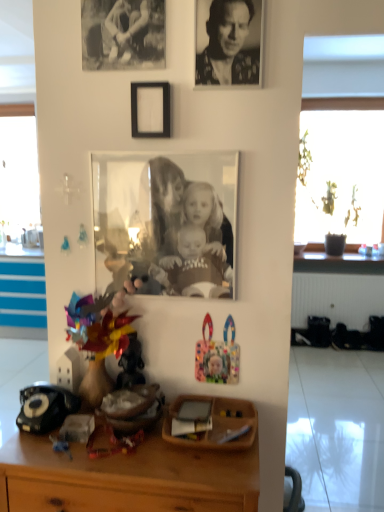
Question: Which direction should I rotate to look at multicolored plastic toy at lower center, which appears as the 3th toy when viewed from the left?

Choices:
 (A) left
 (B) right

Answer: (B)

Question: Is matte glass photo frame at center, positioned as the third picture frame in top-to-bottom order, thinner than wooden desk at center?

Choices:
 (A) yes
 (B) no

Answer: (A)

Question: Is matte glass photo frame at center, placed as the 1th picture frame when sorted from bottom to top, not close to wooden desk at center?

Choices:
 (A) no
 (B) yes

Answer: (A)

Question: Is matte glass photo frame at center, placed as the 1th picture frame when sorted from bottom to top, placed right next to wooden desk at center?

Choices:
 (A) no
 (B) yes

Answer: (A)

Question: Considering the relative positions of matte glass photo frame at center, placed as the 1th picture frame when sorted from bottom to top, and wooden desk at center in the image provided, is matte glass photo frame at center, placed as the 1th picture frame when sorted from bottom to top, to the right of wooden desk at center from the viewer's perspective?

Choices:
 (A) no
 (B) yes

Answer: (B)

Question: Is matte glass photo frame at center, placed as the 1th picture frame when sorted from bottom to top, to the left of wooden desk at center from the viewer's perspective?

Choices:
 (A) yes
 (B) no

Answer: (B)

Question: Considering the relative positions of matte glass photo frame at center, positioned as the third picture frame in top-to-bottom order, and wooden desk at center in the image provided, is matte glass photo frame at center, positioned as the third picture frame in top-to-bottom order, behind wooden desk at center?

Choices:
 (A) no
 (B) yes

Answer: (B)

Question: From a real-world perspective, is wooden desk at center physically below multicolored plastic toy at lower center, which appears as the 3th toy when viewed from the left?

Choices:
 (A) yes
 (B) no

Answer: (A)

Question: Does wooden desk at center have a greater width compared to multicolored plastic toy at lower center, which appears as the 3th toy when viewed from the left?

Choices:
 (A) yes
 (B) no

Answer: (A)

Question: Can you confirm if wooden desk at center is positioned to the right of multicolored plastic toy at lower center, which appears as the 3th toy when viewed from the left?

Choices:
 (A) yes
 (B) no

Answer: (B)

Question: Does wooden desk at center have a lesser height compared to multicolored plastic toy at lower center, which appears as the 3th toy when viewed from the left?

Choices:
 (A) yes
 (B) no

Answer: (B)

Question: Is wooden desk at center closer to the viewer compared to multicolored plastic toy at lower center, which is the first toy in right-to-left order?

Choices:
 (A) yes
 (B) no

Answer: (A)

Question: Is wooden desk at center far from multicolored plastic toy at lower center, which is the first toy in right-to-left order?

Choices:
 (A) yes
 (B) no

Answer: (B)

Question: Can you confirm if black matte picture frame at upper center, the second picture frame when ordered from top to bottom, is taller than black textured photo at upper center?

Choices:
 (A) no
 (B) yes

Answer: (A)